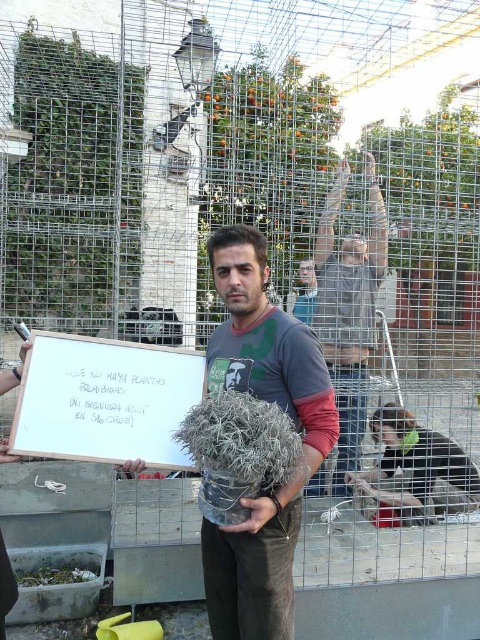
Consider the image. You are a fashion designer observing the scene and want to create a new line of clothing. Which of the two shirts, the gray cotton shirt at center or the dark gray fabric shirt at lower right, would be more suitable for a design that requires a longer silhouette?

The gray cotton shirt at center has a greater height compared to the dark gray fabric shirt at lower right, making it more suitable for a design requiring a longer silhouette.

What are the coordinates of the gray cotton shirt at center?

The gray cotton shirt at center is located at point (x=348, y=310).

Based on the scene description, where is the white paper sign at center located in relation to the man?

The white paper sign at center is located at point (105, 401) in the scene.